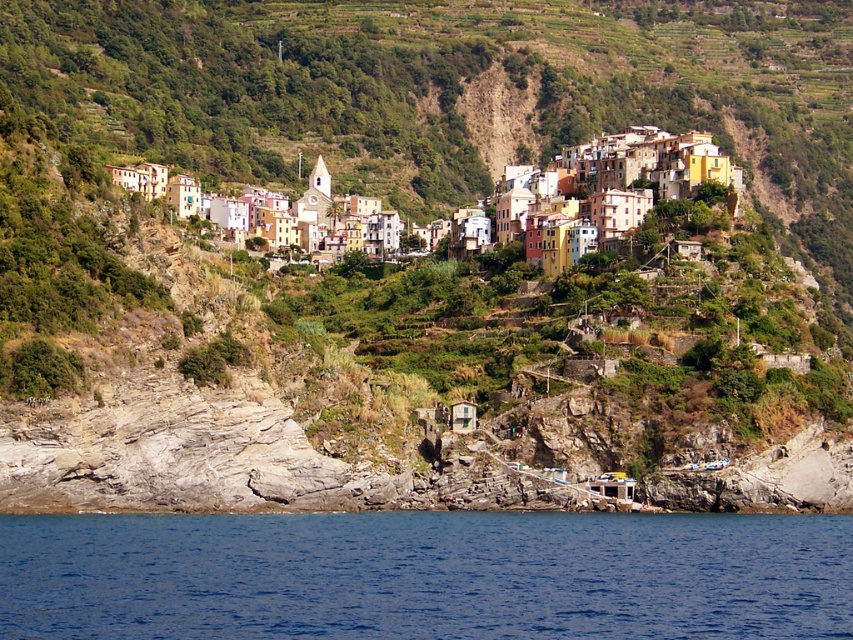
Is blue liquid water at lower center above multicolored stone buildings at upper center?

No.

Is blue liquid water at lower center thinner than multicolored stone buildings at upper center?

In fact, blue liquid water at lower center might be wider than multicolored stone buildings at upper center.

The width and height of the screenshot is (853, 640). What do you see at coordinates (425, 576) in the screenshot?
I see `blue liquid water at lower center` at bounding box center [425, 576].

Find the location of `blue liquid water at lower center`. blue liquid water at lower center is located at coordinates (425, 576).